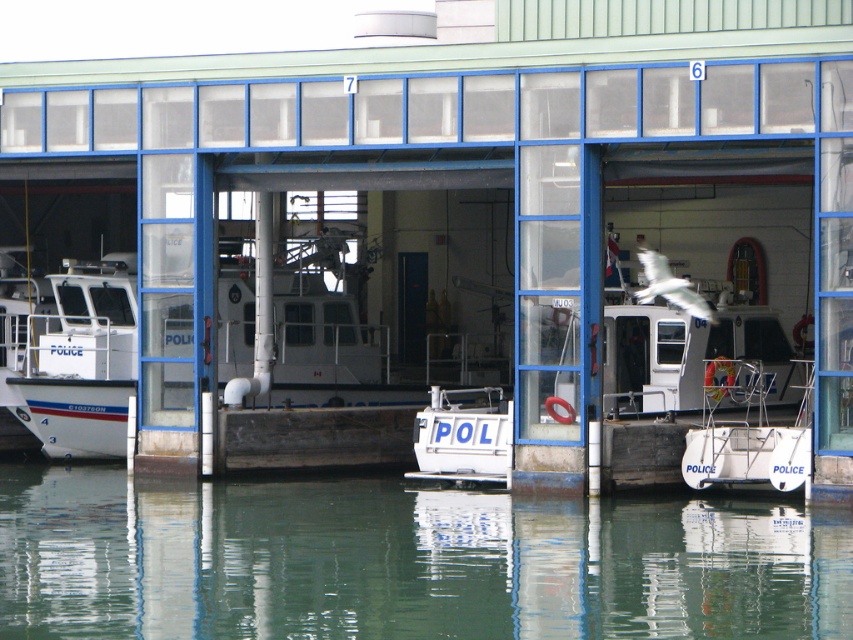
You are a police officer who needs to locate your assigned boat, the white matte police boat at left, in the boathouse. According to the coordinates provided, where exactly is this boat located?

The white matte police boat at left is located at coordinates point (74, 358).

You are a police officer needing to board a boat quickly. You see the white matte police boat at left and the white plastic boat at lower right. Which boat is closer to the entrance of the boathouse?

The white matte police boat at left is positioned on the left side of white plastic boat at lower right, so it is closer to the entrance of the boathouse.